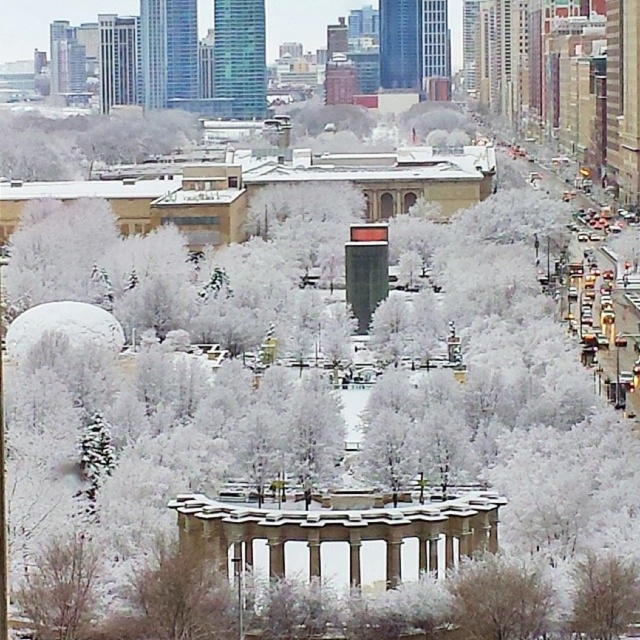
You are standing at the entrance of the gazebo and want to walk to the white frosty tree at lower right. There is a white frosty tree at center blocking your path. Can you walk around it? Please explain your reasoning.

The white frosty tree at center is 4.47 meters away from the white frosty tree at lower right. Since the distance between them allows for a path around the tree, you can walk around the white frosty tree at center to reach the white frosty tree at lower right.

You are standing at the point marked as point (464, 611) in the winter scene. A friend is located exactly 300 feet away from you in the direction of the gazebo. Can they see the gazebo clearly?

The distance between you and your friend is 300 feet, but the point marked as point (464, 611) is 311.84 feet away from the viewer. Since your friend is only 300 feet away from you, they are still 11.84 feet short of reaching the gazebo, so they cannot see it clearly.